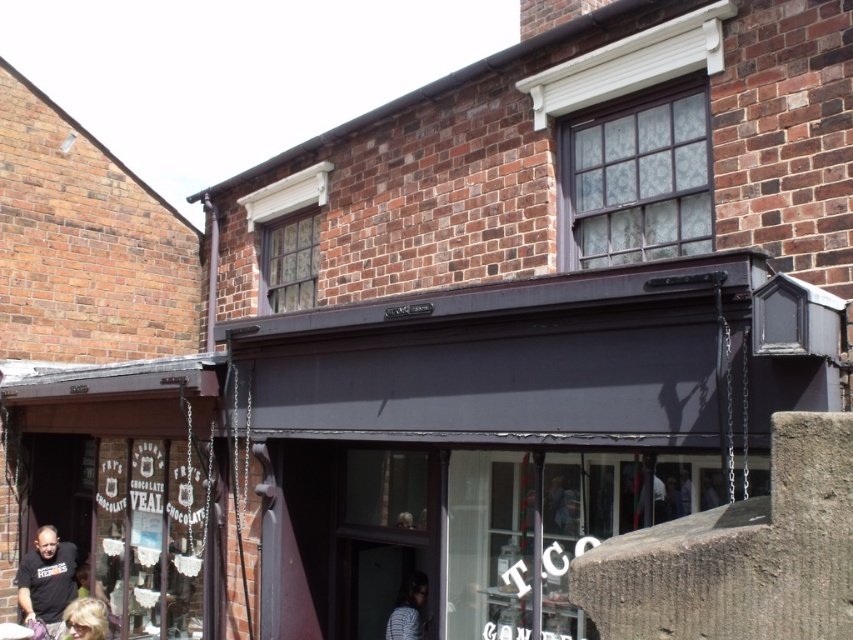
Can you confirm if striped fabric person at lower center is positioned to the right of blonde hair at lower left?

Indeed, striped fabric person at lower center is positioned on the right side of blonde hair at lower left.

Which of these two, striped fabric person at lower center or blonde hair at lower left, stands taller?

Standing taller between the two is striped fabric person at lower center.

Is point (401, 627) positioned before point (74, 627)?

That is False.

Find the location of `striped fabric person at lower center`. striped fabric person at lower center is located at coordinates (408, 609).

Does point (57, 570) come farther from viewer compared to point (105, 627)?

Yes, it is behind point (105, 627).

Describe the element at coordinates (45, 580) in the screenshot. I see `dark gray t-shirt at lower left` at that location.

The image size is (853, 640). I want to click on dark gray t-shirt at lower left, so click(45, 580).

Is dark gray t-shirt at lower left closer to camera compared to striped fabric person at lower center?

That is False.

Can you confirm if dark gray t-shirt at lower left is wider than striped fabric person at lower center?

Yes, dark gray t-shirt at lower left is wider than striped fabric person at lower center.

Locate an element on the screen. dark gray t-shirt at lower left is located at coordinates (45, 580).